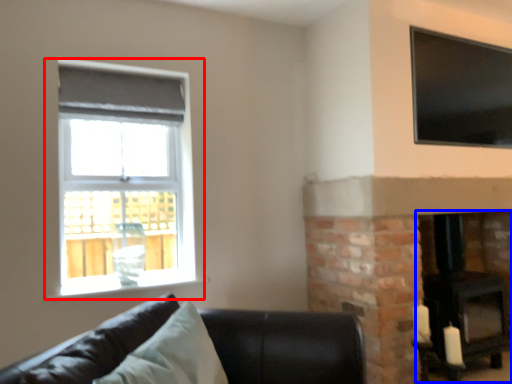
Question: Which object appears farthest to the camera in this image, window (highlighted by a red box) or fireplace (highlighted by a blue box)?

Choices:
 (A) window
 (B) fireplace

Answer: (B)